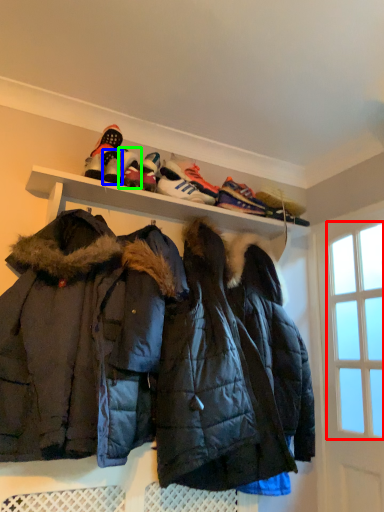
Question: Which object is positioned closest to window screen (highlighted by a red box)? Select from footwear (highlighted by a blue box) and footwear (highlighted by a green box).

Choices:
 (A) footwear
 (B) footwear

Answer: (B)